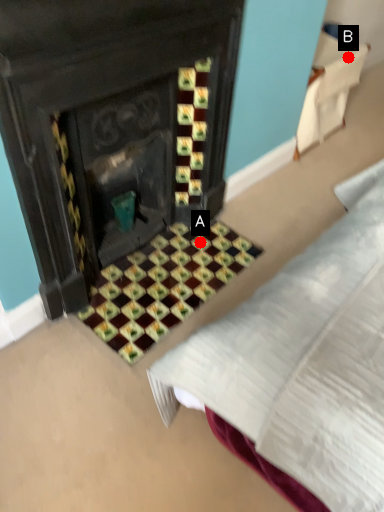
Question: Two points are circled on the image, labeled by A and B beside each circle. Which of the following is the farthest from the observer?

Choices:
 (A) A is further
 (B) B is further

Answer: (B)